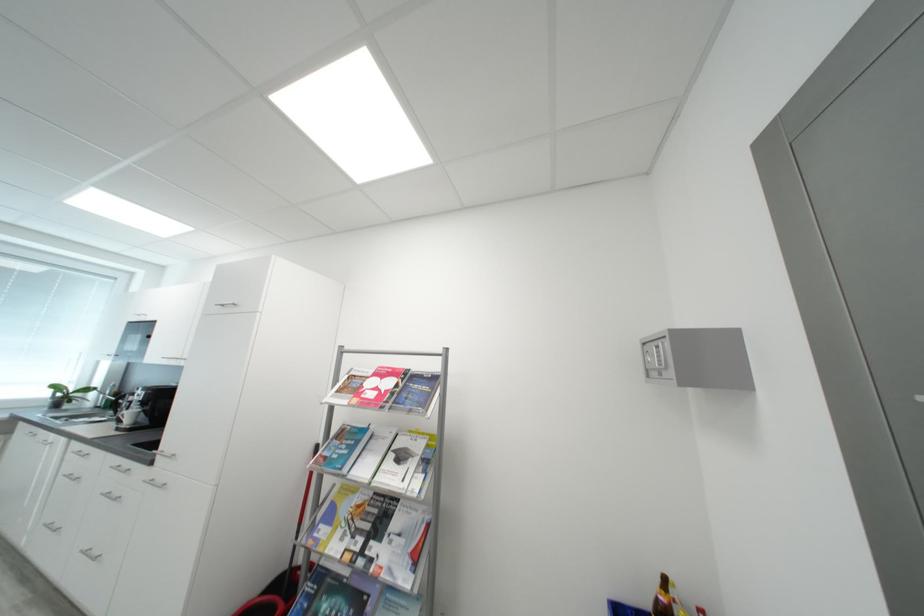
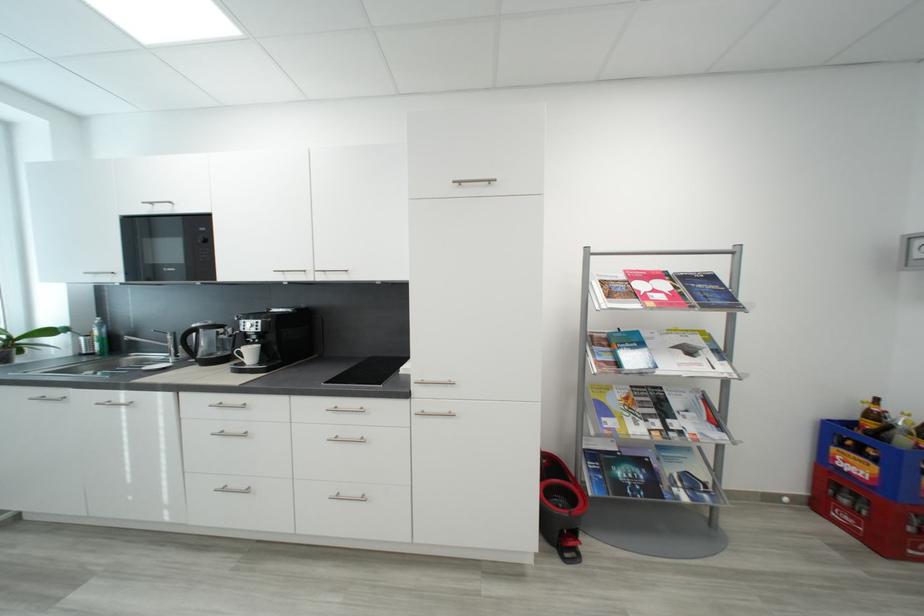
Find the pixel in the second image that matches pixel 407 459 in the first image.

(697, 353)